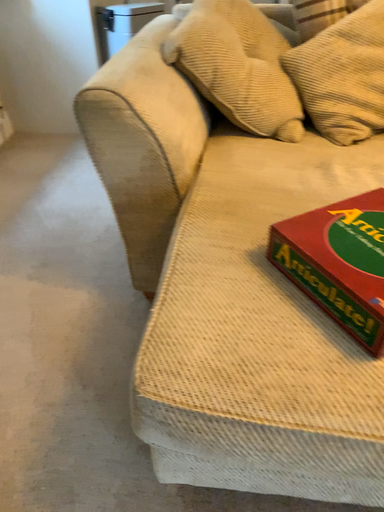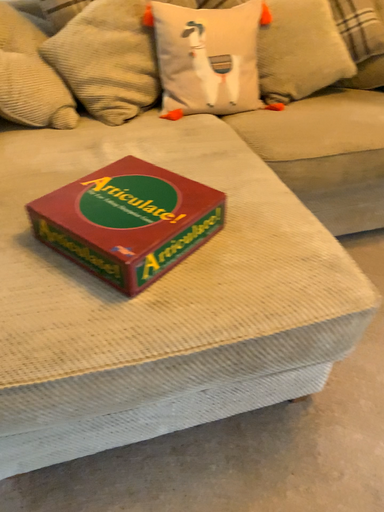
Question: Which way did the camera rotate in the video?

Choices:
 (A) rotated right
 (B) rotated left

Answer: (A)